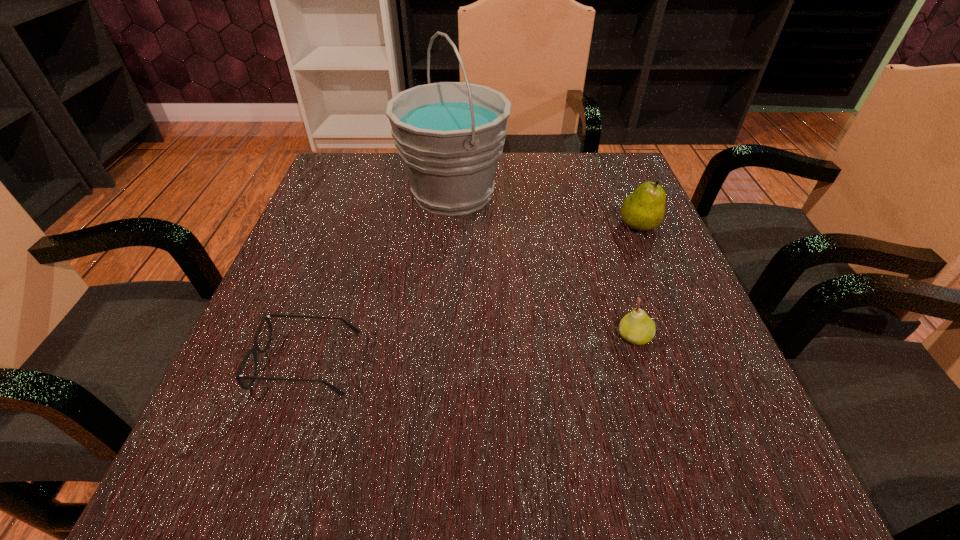
At what (x,y) coordinates should I click in order to perform the action: click on free location located on the back of the left pear. Please return your answer as a coordinate pair (x, y). Looking at the image, I should click on (606, 247).

Locate an element on the screen. The image size is (960, 540). vacant space located with the lenses facing outward on the leftmost object is located at coordinates (490, 362).

Identify the location of object located at the far edge. This screenshot has height=540, width=960. (450, 135).

Where is `object that is at the left edge`? This screenshot has height=540, width=960. object that is at the left edge is located at coordinates (255, 348).

You are a GUI agent. You are given a task and a screenshot of the screen. Output one action in this format:
    pyautogui.click(x=<x>, y=<y>)
    Task: Click on the free space at the far edge of the desktop
    
    Given the screenshot: What is the action you would take?
    pyautogui.click(x=537, y=176)

The width and height of the screenshot is (960, 540). I want to click on vacant area at the near edge, so click(x=405, y=510).

Find the location of `vacant space at the left edge`. vacant space at the left edge is located at coordinates (339, 213).

Locate an element on the screen. This screenshot has width=960, height=540. vacant space at the right edge is located at coordinates (667, 251).

Locate an element on the screen. free region at the far left corner of the desktop is located at coordinates (325, 179).

Where is `unoccupied position between the spectacles and the nearer pear`? The height and width of the screenshot is (540, 960). unoccupied position between the spectacles and the nearer pear is located at coordinates (470, 350).